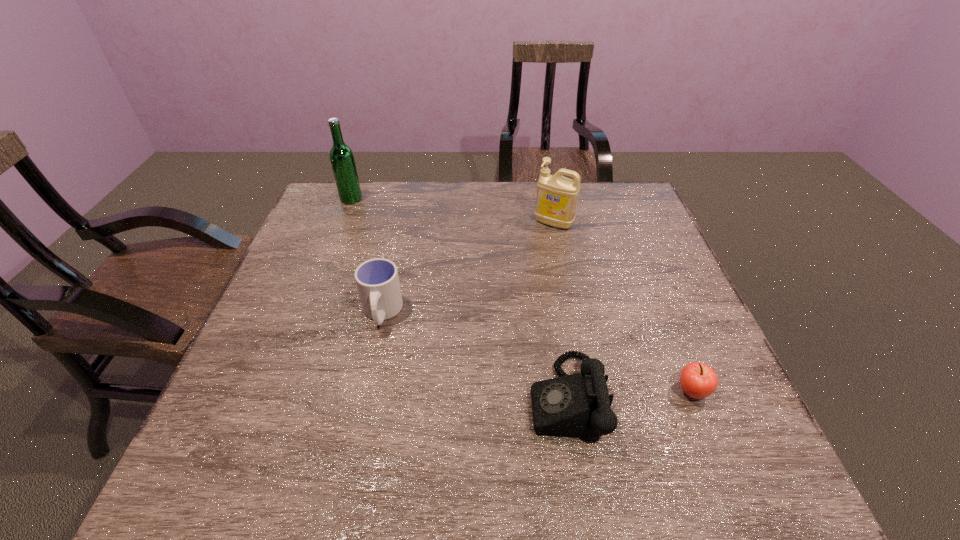
Identify the location of vacant space that is in between the second farthest object and the farthest object. The width and height of the screenshot is (960, 540). (452, 211).

I want to click on vacant space that is in between the tallest object and the rightmost object, so click(x=521, y=295).

Identify the location of vacant area between the tallest object and the fourth nearest object. (452, 211).

This screenshot has width=960, height=540. Find the location of `vacant space that is in between the fourth shortest object and the apple`. vacant space that is in between the fourth shortest object and the apple is located at coordinates (623, 307).

You are a GUI agent. You are given a task and a screenshot of the screen. Output one action in this format:
    pyautogui.click(x=<x>, y=<y>)
    Task: Click on the vacant space that's between the rightmost object and the fourth object from right to left
    
    Given the screenshot: What is the action you would take?
    pyautogui.click(x=537, y=352)

The height and width of the screenshot is (540, 960). What are the coordinates of `vacant region between the second shortest object and the leftmost object` in the screenshot? It's located at (459, 299).

Locate an element on the screen. vacant region between the third nearest object and the farthest object is located at coordinates (367, 256).

The height and width of the screenshot is (540, 960). Identify the location of vacant space in between the third nearest object and the beer bottle. (367, 256).

At what (x,y) coordinates should I click in order to perform the action: click on unoccupied position between the cup and the telephone. Please return your answer as a coordinate pair (x, y). Image resolution: width=960 pixels, height=540 pixels. Looking at the image, I should click on (473, 355).

This screenshot has height=540, width=960. What are the coordinates of `object that can be found as the second closest to the telephone` in the screenshot? It's located at (377, 280).